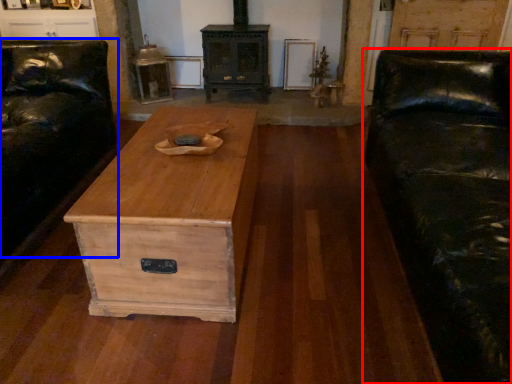
Question: Which object is closer to the camera taking this photo, studio couch (highlighted by a red box) or couch (highlighted by a blue box)?

Choices:
 (A) studio couch
 (B) couch

Answer: (A)